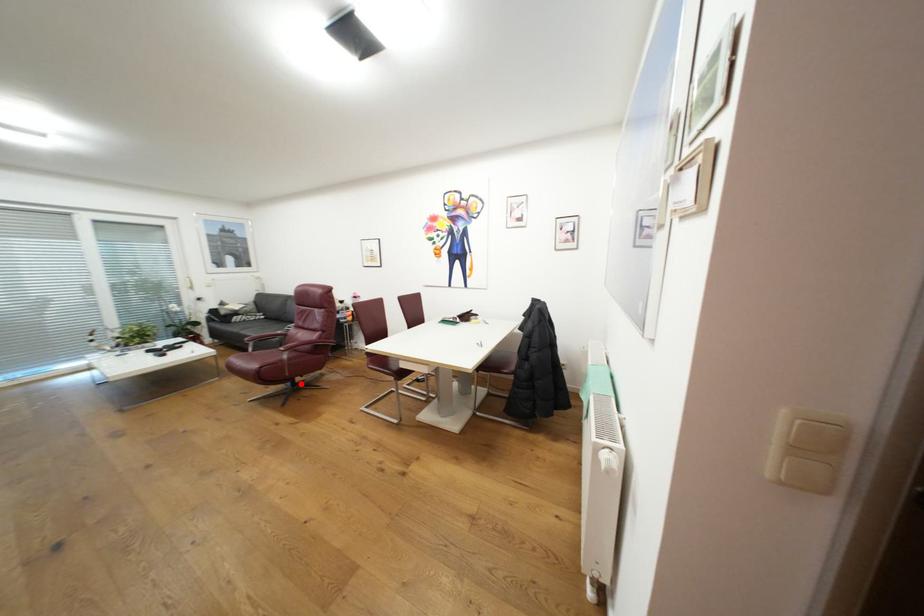
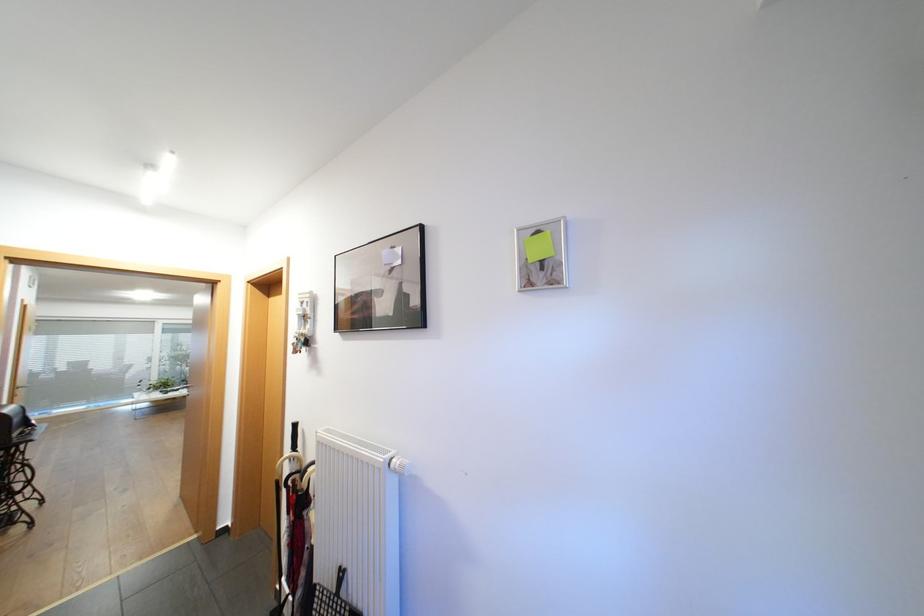
Question: I am providing you with two images of the same scene from different viewpoints. A red point is marked on the first image. Can you still see the location of the red point in image 2?

Choices:
 (A) Yes
 (B) No

Answer: (B)